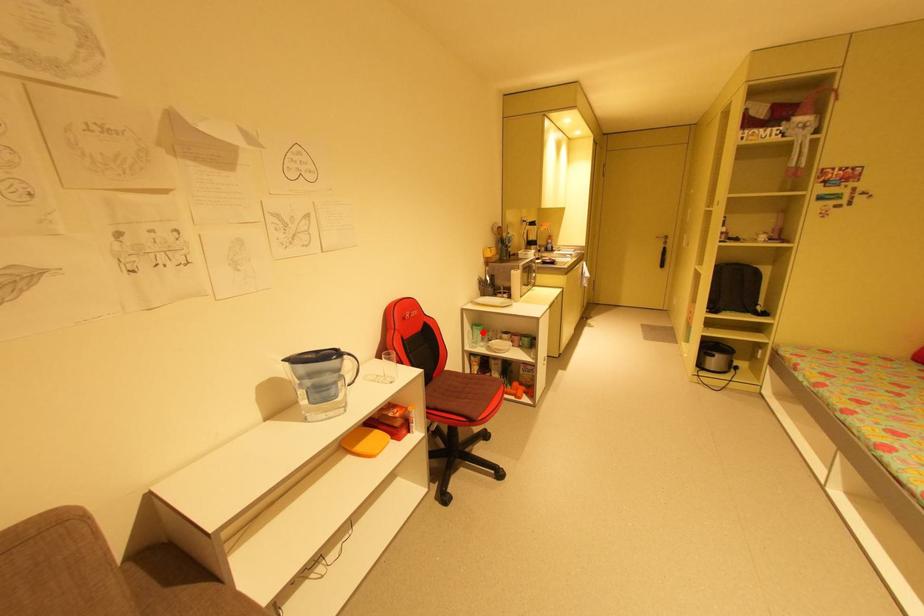
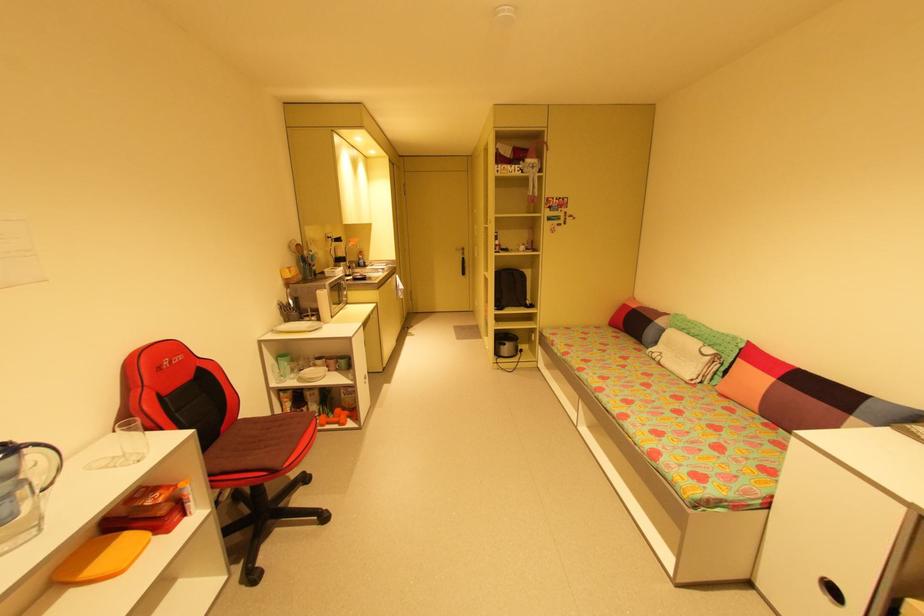
Question: I am providing you with two images of the same scene from different viewpoints. In image1, a red point is highlighted. Considering the same 3D point in image2, which of the following is correct?

Choices:
 (A) It is closer
 (B) It is farther

Answer: (A)